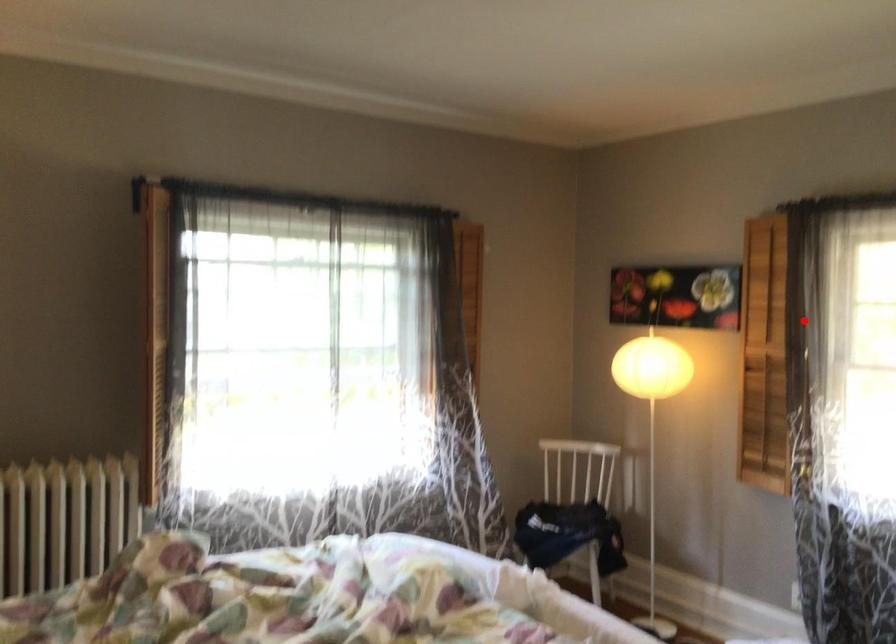
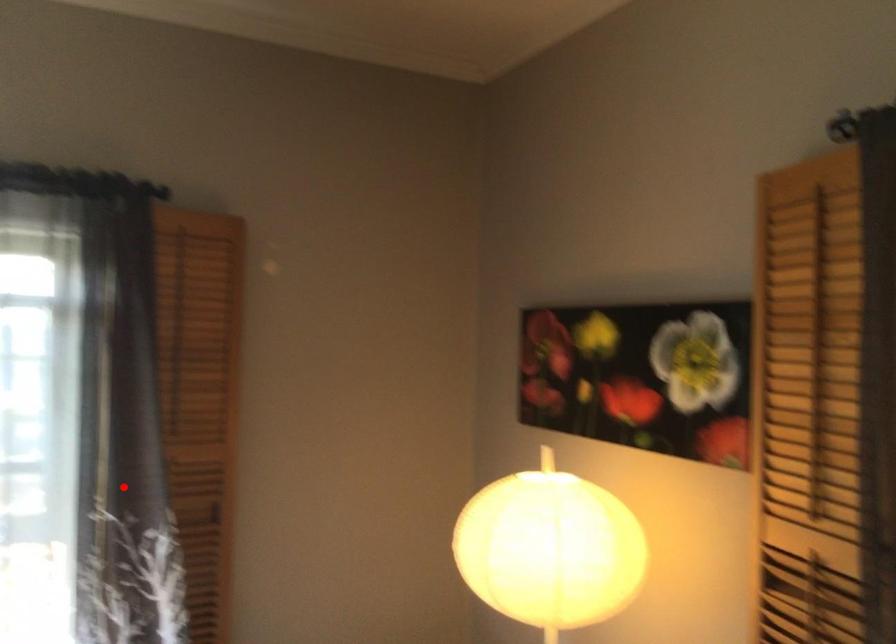
I am providing you with two images of the same scene from different viewpoints. A red point is marked on the first image and another point is marked on the second image. Is the red point in image1 aligned with the point shown in image2?

No